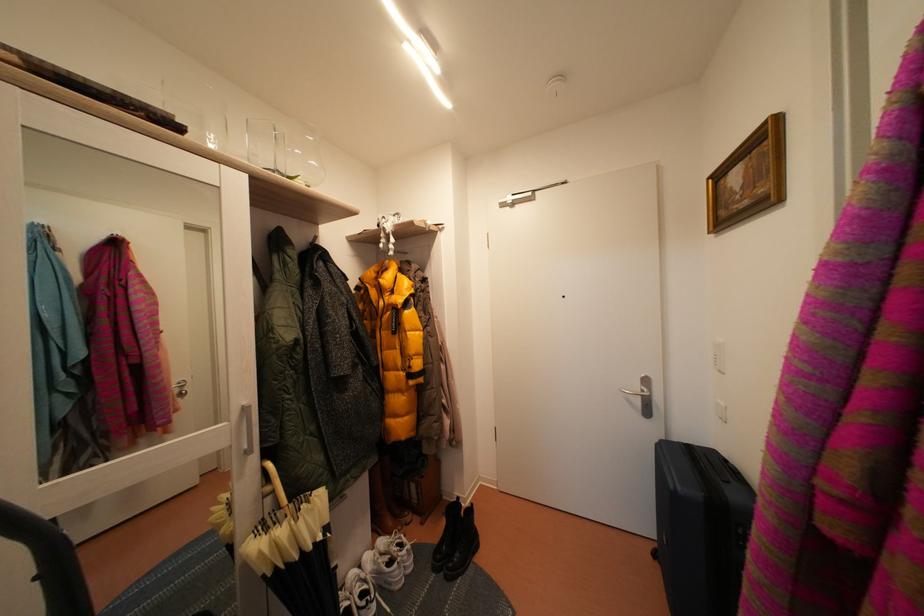
The height and width of the screenshot is (616, 924). What do you see at coordinates (456, 541) in the screenshot?
I see `a black boot` at bounding box center [456, 541].